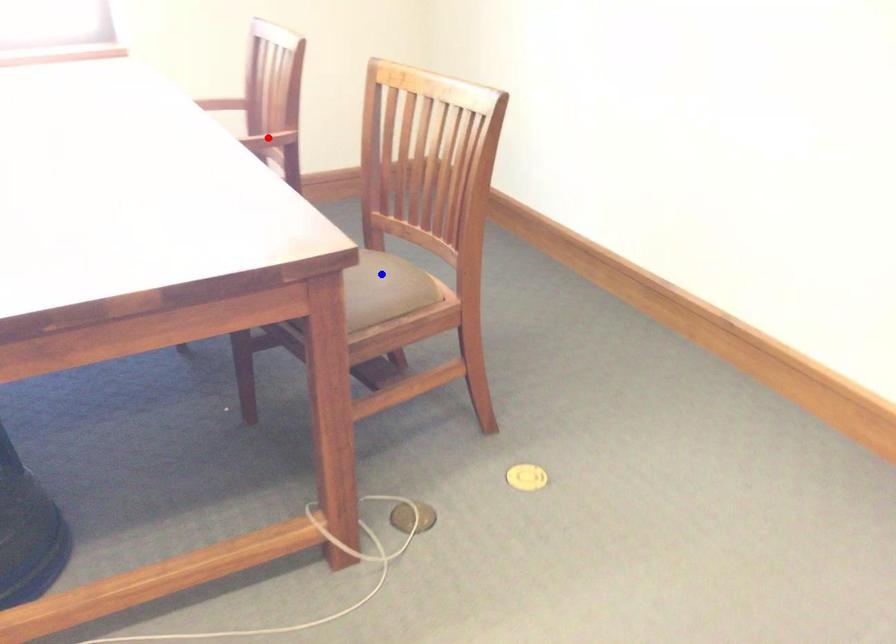
Question: Two points are marked on the image. Which point is closer to the camera?

Choices:
 (A) Blue point is closer.
 (B) Red point is closer.

Answer: (A)